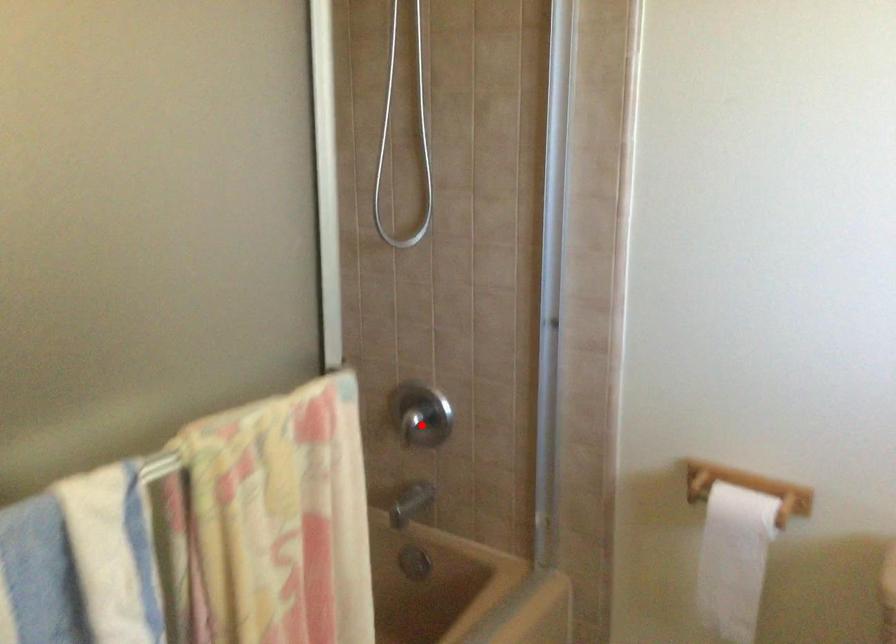
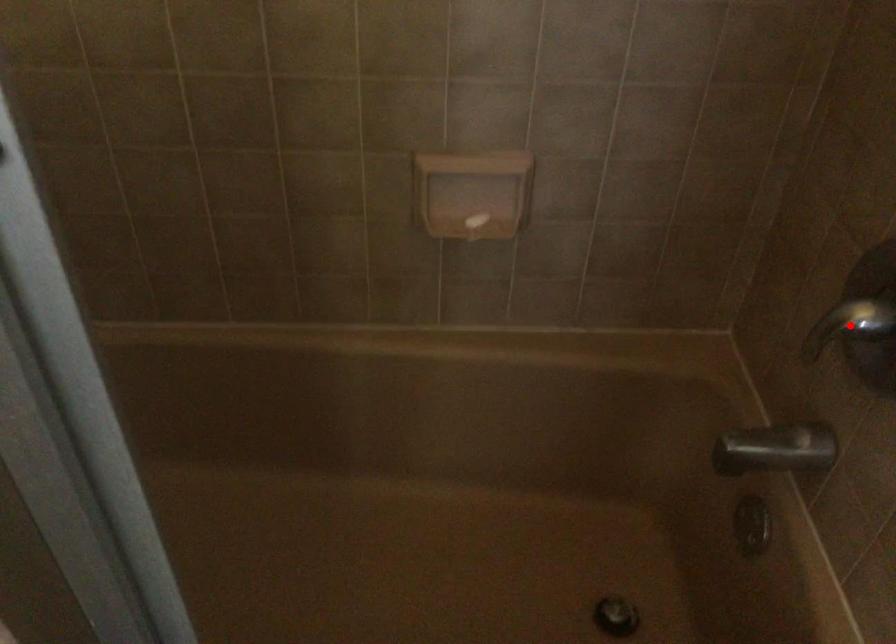
I am providing you with two images of the same scene from different viewpoints. A red point is marked on the first image and another point is marked on the second image. Is the marked point in image1 the same physical position as the marked point in image2?

Yes